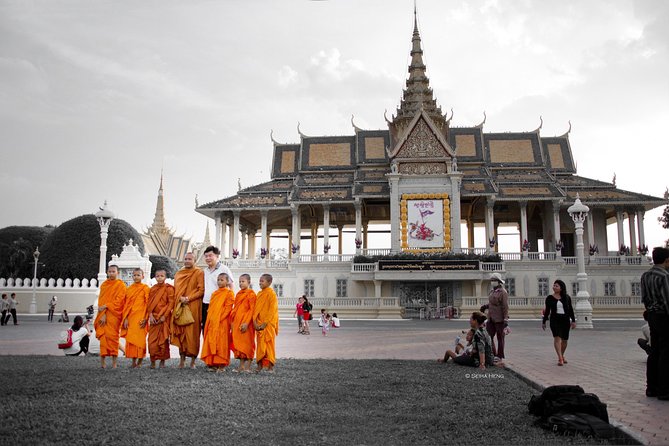
The height and width of the screenshot is (446, 669). Find the location of `window`. window is located at coordinates pyautogui.click(x=341, y=291).